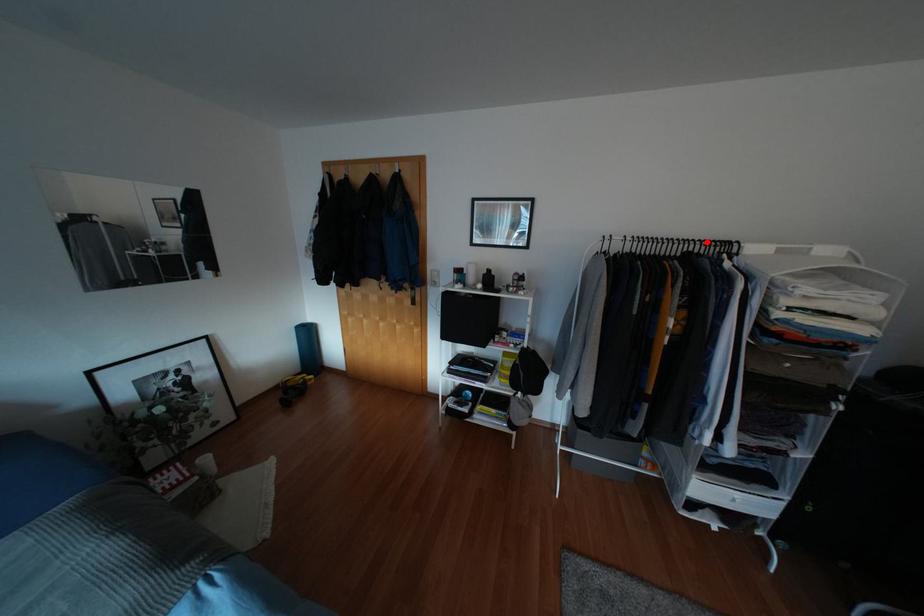
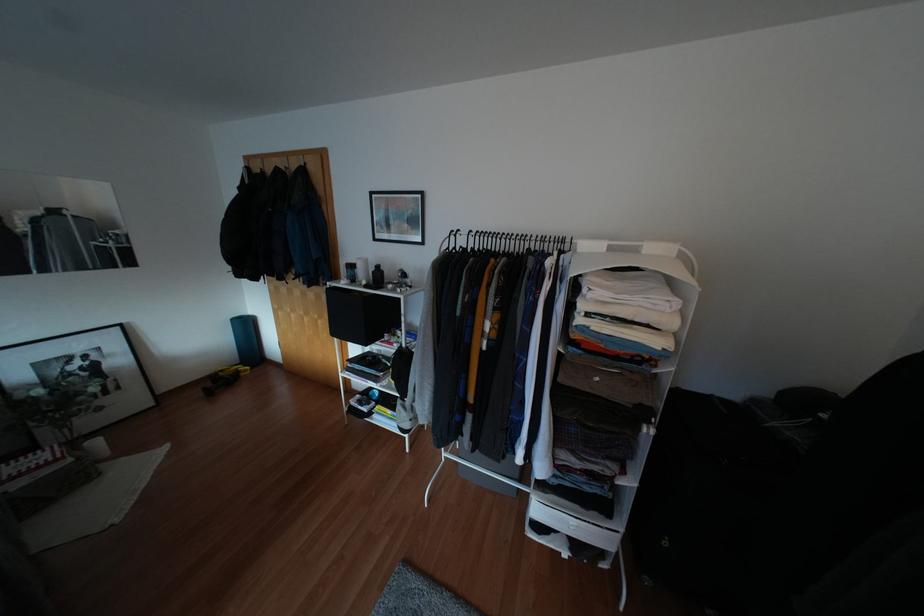
Find the pixel in the second image that matches the highlighted location in the first image.

(542, 238)